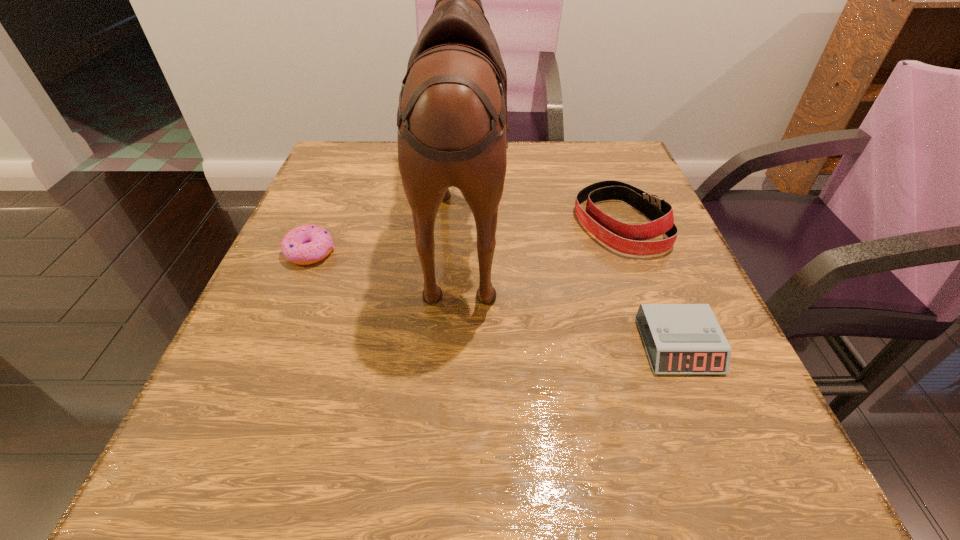
You are a GUI agent. You are given a task and a screenshot of the screen. Output one action in this format:
    pyautogui.click(x=<x>, y=<y>)
    Task: Click on the vacant region between the leftmost object and the dog collar
    This screenshot has height=540, width=960.
    Given the screenshot: What is the action you would take?
    pyautogui.click(x=465, y=238)

This screenshot has width=960, height=540. Find the location of `free space between the alarm clock and the third shortest object`. free space between the alarm clock and the third shortest object is located at coordinates (649, 285).

Identify the location of free point between the leftmost object and the tallest object. (387, 235).

Where is `vacant area that lies between the tallest object and the dog collar`? The width and height of the screenshot is (960, 540). vacant area that lies between the tallest object and the dog collar is located at coordinates (541, 221).

Locate an element on the screen. This screenshot has height=540, width=960. free space between the dog collar and the alarm clock is located at coordinates (649, 285).

At what (x,y) coordinates should I click in order to perform the action: click on vacant space that is in between the third shortest object and the alarm clock. Please return your answer as a coordinate pair (x, y). This screenshot has width=960, height=540. Looking at the image, I should click on (649, 285).

Where is `vacant area that lies between the dog collar and the saddle`? Image resolution: width=960 pixels, height=540 pixels. vacant area that lies between the dog collar and the saddle is located at coordinates (541, 221).

Point out which object is positioned as the nearest to the alarm clock. Please provide its 2D coordinates. Your answer should be formatted as a tuple, i.e. [(x, y)], where the tuple contains the x and y coordinates of a point satisfying the conditions above.

[(626, 238)]

Point out which object is positioned as the second nearest to the alarm clock. Please provide its 2D coordinates. Your answer should be formatted as a tuple, i.e. [(x, y)], where the tuple contains the x and y coordinates of a point satisfying the conditions above.

[(452, 124)]

Locate an element on the screen. The height and width of the screenshot is (540, 960). free space that satisfies the following two spatial constraints: 1. on the back side of the second tallest object; 2. on the back of the tallest object is located at coordinates (617, 218).